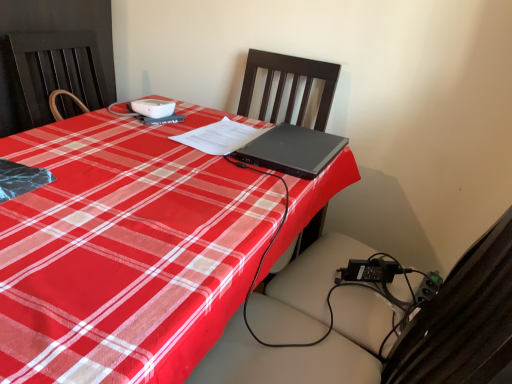
Question: Does black matte laptop at center have a greater width compared to black wood chair at center?

Choices:
 (A) yes
 (B) no

Answer: (B)

Question: Could you tell me if black matte laptop at center is turned towards black wood chair at center?

Choices:
 (A) yes
 (B) no

Answer: (A)

Question: Is black matte laptop at center taller than black wood chair at center?

Choices:
 (A) yes
 (B) no

Answer: (B)

Question: From a real-world perspective, does black matte laptop at center sit lower than black wood chair at center?

Choices:
 (A) yes
 (B) no

Answer: (B)

Question: From a real-world perspective, is black matte laptop at center located higher than black wood chair at center?

Choices:
 (A) no
 (B) yes

Answer: (B)

Question: From the image's perspective, would you say black matte laptop at center is shown under black wood chair at center?

Choices:
 (A) yes
 (B) no

Answer: (A)

Question: Can you confirm if black wood chair at center is wider than black matte laptop at center?

Choices:
 (A) no
 (B) yes

Answer: (B)

Question: Are black wood chair at center and black matte laptop at center beside each other?

Choices:
 (A) yes
 (B) no

Answer: (B)

Question: From a real-world perspective, is black wood chair at center positioned under black matte laptop at center based on gravity?

Choices:
 (A) yes
 (B) no

Answer: (A)

Question: Is black wood chair at center turned away from black matte laptop at center?

Choices:
 (A) yes
 (B) no

Answer: (B)

Question: Is black wood chair at center outside of black matte laptop at center?

Choices:
 (A) yes
 (B) no

Answer: (A)

Question: Considering the relative sizes of black wood chair at center and black matte laptop at center in the image provided, is black wood chair at center smaller than black matte laptop at center?

Choices:
 (A) no
 (B) yes

Answer: (A)

Question: Is black plastic swivel chair at center wider than black wood chair at center?

Choices:
 (A) yes
 (B) no

Answer: (A)